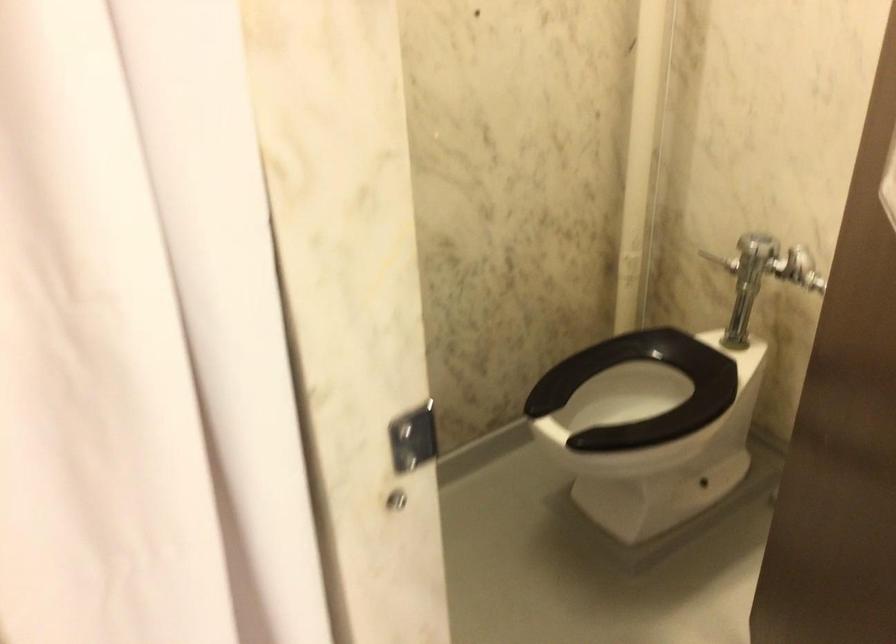
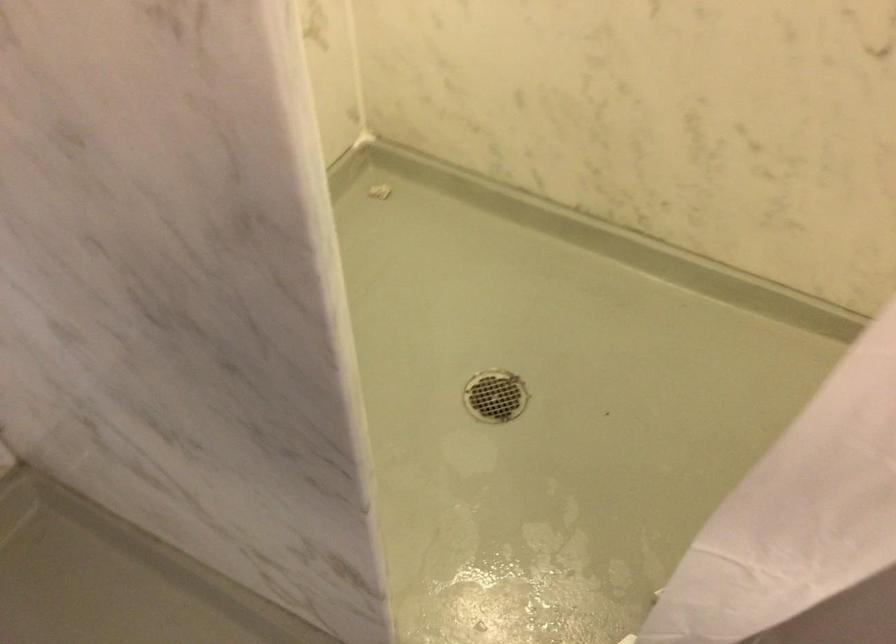
The images are taken continuously from a first-person perspective. In which direction is your viewpoint rotating?

The camera's rotation is toward left-down.